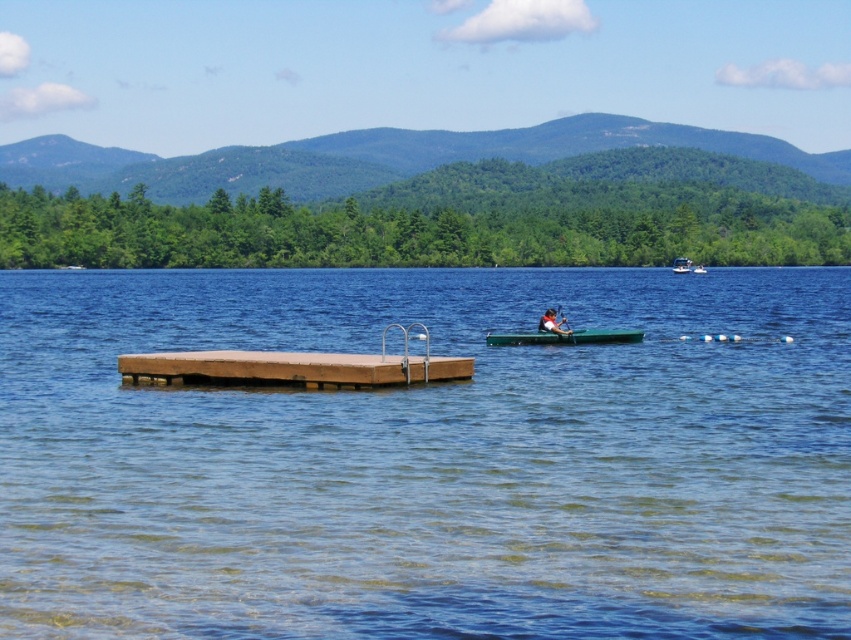
Between point (712, 301) and point (248, 378), which one is positioned in front?

Point (248, 378) is more forward.

Who is more distant from viewer, (x=361, y=525) or (x=450, y=372)?

The point (x=450, y=372) is more distant.

Is point (133, 516) farther from viewer compared to point (209, 378)?

No, (133, 516) is in front of (209, 378).

The image size is (851, 640). I want to click on clear water at center, so click(x=427, y=458).

Image resolution: width=851 pixels, height=640 pixels. What are the coordinates of `brown wood dock at center` in the screenshot? It's located at (295, 368).

Describe the element at coordinates (295, 368) in the screenshot. I see `brown wood dock at center` at that location.

Find the location of a particular element. The width and height of the screenshot is (851, 640). brown wood dock at center is located at coordinates (295, 368).

In order to click on brown wood dock at center in this screenshot , I will do `click(295, 368)`.

Who is positioned more to the right, clear water at center or green plastic boat at upper right?

green plastic boat at upper right

You are a GUI agent. You are given a task and a screenshot of the screen. Output one action in this format:
    pyautogui.click(x=<x>, y=<y>)
    Task: Click on the clear water at center
    The width and height of the screenshot is (851, 640).
    Given the screenshot: What is the action you would take?
    pyautogui.click(x=427, y=458)

Image resolution: width=851 pixels, height=640 pixels. Find the location of `clear water at center`. clear water at center is located at coordinates (427, 458).

Image resolution: width=851 pixels, height=640 pixels. Identify the location of clear water at center. (427, 458).